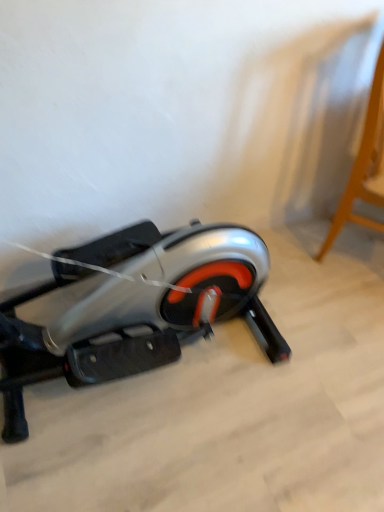
Question: Does point (355, 174) appear closer or farther from the camera than point (147, 253)?

Choices:
 (A) closer
 (B) farther

Answer: (B)

Question: Is light wood stool at upper right to the left or to the right of silver metallic stationary bicycle at lower left in the image?

Choices:
 (A) right
 (B) left

Answer: (A)

Question: From the image's perspective, is light wood stool at upper right above or below silver metallic stationary bicycle at lower left?

Choices:
 (A) above
 (B) below

Answer: (A)

Question: From a real-world perspective, is silver metallic stationary bicycle at lower left positioned above or below light wood stool at upper right?

Choices:
 (A) above
 (B) below

Answer: (B)

Question: Considering the positions of silver metallic stationary bicycle at lower left and light wood stool at upper right in the image, is silver metallic stationary bicycle at lower left bigger or smaller than light wood stool at upper right?

Choices:
 (A) big
 (B) small

Answer: (B)

Question: Which is correct: silver metallic stationary bicycle at lower left is inside light wood stool at upper right, or outside of it?

Choices:
 (A) outside
 (B) inside

Answer: (A)

Question: Looking at their shapes, would you say silver metallic stationary bicycle at lower left is wider or thinner than light wood stool at upper right?

Choices:
 (A) thin
 (B) wide

Answer: (B)